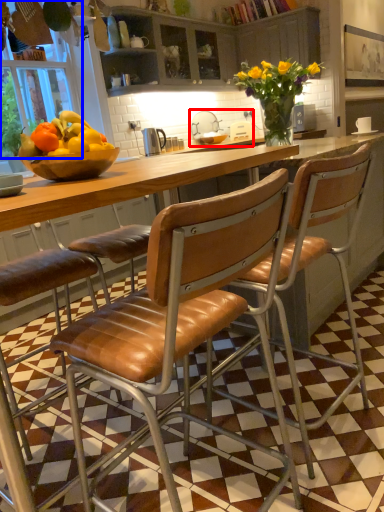
Question: Which object is further to the camera taking this photo, sink (highlighted by a red box) or window screen (highlighted by a blue box)?

Choices:
 (A) sink
 (B) window screen

Answer: (A)